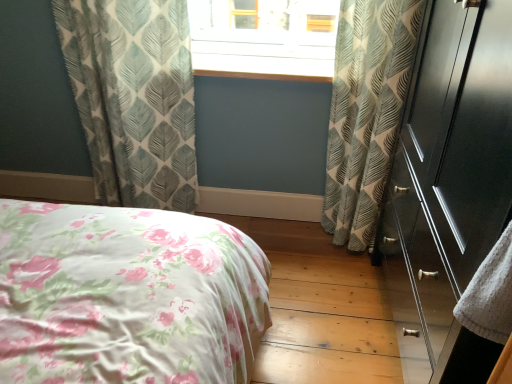
Question: Looking at the image, does glossy dark wood dresser at right seem bigger or smaller compared to light blue textured curtains at upper left, marked as the second curtain in a right-to-left arrangement?

Choices:
 (A) big
 (B) small

Answer: (A)

Question: Is point (504, 192) positioned closer to the camera than point (151, 34)?

Choices:
 (A) closer
 (B) farther

Answer: (A)

Question: Which object is positioned farthest from the leaf-patterned fabric curtain at right, the 2th curtain from the left?

Choices:
 (A) glossy dark wood dresser at right
 (B) wooden at center
 (C) light blue textured curtains at upper left, acting as the 1th curtain starting from the left

Answer: (C)

Question: Which is farther from the wooden at center?

Choices:
 (A) glossy dark wood dresser at right
 (B) light blue textured curtains at upper left, marked as the second curtain in a right-to-left arrangement
 (C) leaf-patterned fabric curtain at right, the 2th curtain from the left

Answer: (A)